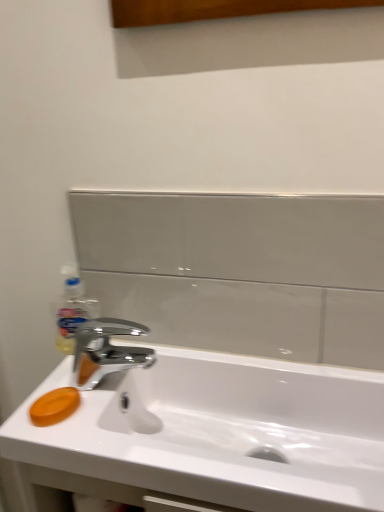
Locate an element on the screen. The height and width of the screenshot is (512, 384). white glossy sink at center is located at coordinates (209, 432).

What is the approximate width of orange matte soap at lower left?

The width of orange matte soap at lower left is 3.31 inches.

The image size is (384, 512). I want to click on orange matte soap at lower left, so click(54, 406).

What are the coordinates of `white glossy sink at center` in the screenshot? It's located at point(209,432).

Does white glossy sink at center have a greater width compared to translucent plastic soap dispenser at left?

Yes.

How different are the orientations of white glossy sink at center and translucent plastic soap dispenser at left in degrees?

2.1 degrees.

Which is behind, white glossy sink at center or translucent plastic soap dispenser at left?

translucent plastic soap dispenser at left.

Could you tell me if white glossy sink at center is turned towards translucent plastic soap dispenser at left?

No, white glossy sink at center is not facing towards translucent plastic soap dispenser at left.

Locate an element on the screen. Image resolution: width=384 pixels, height=512 pixels. bottle lying above the orange matte soap at lower left (from the image's perspective) is located at coordinates (72, 310).

Measure the distance between translucent plastic soap dispenser at left and orange matte soap at lower left.

5.07 inches.

Is orange matte soap at lower left located within translucent plastic soap dispenser at left?

No, orange matte soap at lower left is not a part of translucent plastic soap dispenser at left.

From the image's perspective, is translucent plastic soap dispenser at left positioned above or below orange matte soap at lower left?

translucent plastic soap dispenser at left is above orange matte soap at lower left.

Who is bigger, chrome metallic faucet at center or translucent plastic soap dispenser at left?

chrome metallic faucet at center.

Is chrome metallic faucet at center inside the boundaries of translucent plastic soap dispenser at left, or outside?

chrome metallic faucet at center is spatially situated outside translucent plastic soap dispenser at left.

Considering the relative sizes of chrome metallic faucet at center and translucent plastic soap dispenser at left in the image provided, is chrome metallic faucet at center shorter than translucent plastic soap dispenser at left?

Yes, chrome metallic faucet at center is shorter than translucent plastic soap dispenser at left.

Is translucent plastic soap dispenser at left at the back of chrome metallic faucet at center?

No, chrome metallic faucet at center is not facing the opposite direction of translucent plastic soap dispenser at left.

How many degrees apart are the facing directions of chrome metallic faucet at center and orange matte soap at lower left?

chrome metallic faucet at center and orange matte soap at lower left are facing 86.9 degrees away from each other.

Considering the points (78, 387) and (78, 401), which point is in front, point (78, 387) or point (78, 401)?

The point (78, 401) is more forward.

Considering the sizes of objects chrome metallic faucet at center and orange matte soap at lower left in the image provided, who is smaller, chrome metallic faucet at center or orange matte soap at lower left?

With smaller size is orange matte soap at lower left.

Is chrome metallic faucet at center wider than orange matte soap at lower left?

Yes, chrome metallic faucet at center is wider than orange matte soap at lower left.

Is orange matte soap at lower left inside or outside of white glossy sink at center?

orange matte soap at lower left is not enclosed by white glossy sink at center.

From the image's perspective, who appears lower, orange matte soap at lower left or white glossy sink at center?

white glossy sink at center appears lower in the image.

Is white glossy sink at center at the back of orange matte soap at lower left?

No, orange matte soap at lower left is not facing away from white glossy sink at center.

Is point (58, 403) positioned behind point (366, 454)?

No.

From the image's perspective, is white glossy sink at center above orange matte soap at lower left?

No, from the image's perspective, white glossy sink at center is not over orange matte soap at lower left.

Between point (8, 445) and point (75, 388), which one is positioned behind?

The point (75, 388) is farther from the camera.

Does white glossy sink at center appear on the right side of orange matte soap at lower left?

Indeed, white glossy sink at center is positioned on the right side of orange matte soap at lower left.

What's the angular difference between translucent plastic soap dispenser at left and white glossy sink at center's facing directions?

The facing directions of translucent plastic soap dispenser at left and white glossy sink at center are 2.1 degrees apart.

Would you say translucent plastic soap dispenser at left is inside or outside white glossy sink at center?

translucent plastic soap dispenser at left cannot be found inside white glossy sink at center.

Which object is closer to the camera, translucent plastic soap dispenser at left or white glossy sink at center?

white glossy sink at center is in front.

Locate an element on the screen. bottle above the white glossy sink at center (from a real-world perspective) is located at coordinates (72, 310).

This screenshot has height=512, width=384. Find the location of `sink below the translucent plastic soap dispenser at left (from the image's perspective)`. sink below the translucent plastic soap dispenser at left (from the image's perspective) is located at coordinates (209, 432).

You are a GUI agent. You are given a task and a screenshot of the screen. Output one action in this format:
    pyautogui.click(x=<x>, y=<y>)
    Task: Click on the bottle on the left of orange matte soap at lower left
    
    Given the screenshot: What is the action you would take?
    pyautogui.click(x=72, y=310)

When comparing their distances from white glossy sink at center, does translucent plastic soap dispenser at left or chrome metallic faucet at center seem closer?

chrome metallic faucet at center is positioned closer to the anchor white glossy sink at center.

Considering their positions, is white glossy sink at center positioned closer to translucent plastic soap dispenser at left than chrome metallic faucet at center?

chrome metallic faucet at center is positioned closer to the anchor translucent plastic soap dispenser at left.

Considering their positions, is translucent plastic soap dispenser at left positioned further to orange matte soap at lower left than white glossy sink at center?

white glossy sink at center is further to orange matte soap at lower left.

Estimate the real-world distances between objects in this image. Which object is further from translucent plastic soap dispenser at left, orange matte soap at lower left or chrome metallic faucet at center?

orange matte soap at lower left is positioned further to the anchor translucent plastic soap dispenser at left.

Estimate the real-world distances between objects in this image. Which object is further from orange matte soap at lower left, translucent plastic soap dispenser at left or chrome metallic faucet at center?

Based on the image, translucent plastic soap dispenser at left appears to be further to orange matte soap at lower left.

Estimate the real-world distances between objects in this image. Which object is closer to orange matte soap at lower left, white glossy sink at center or translucent plastic soap dispenser at left?

Among the two, translucent plastic soap dispenser at left is located nearer to orange matte soap at lower left.

In the scene shown: Looking at the image, which one is located further to chrome metallic faucet at center, white glossy sink at center or translucent plastic soap dispenser at left?

Among the two, white glossy sink at center is located further to chrome metallic faucet at center.

Considering their positions, is orange matte soap at lower left positioned further to chrome metallic faucet at center than translucent plastic soap dispenser at left?

orange matte soap at lower left.

Where is `soap between chrome metallic faucet at center and white glossy sink at center in the vertical direction`? soap between chrome metallic faucet at center and white glossy sink at center in the vertical direction is located at coordinates (54, 406).

The image size is (384, 512). I want to click on tap that lies between translucent plastic soap dispenser at left and orange matte soap at lower left from top to bottom, so [x=107, y=351].

Find the location of a particular element. This screenshot has width=384, height=512. tap between translucent plastic soap dispenser at left and white glossy sink at center from top to bottom is located at coordinates (107, 351).

Image resolution: width=384 pixels, height=512 pixels. Identify the location of soap between translucent plastic soap dispenser at left and white glossy sink at center in the vertical direction. (54, 406).